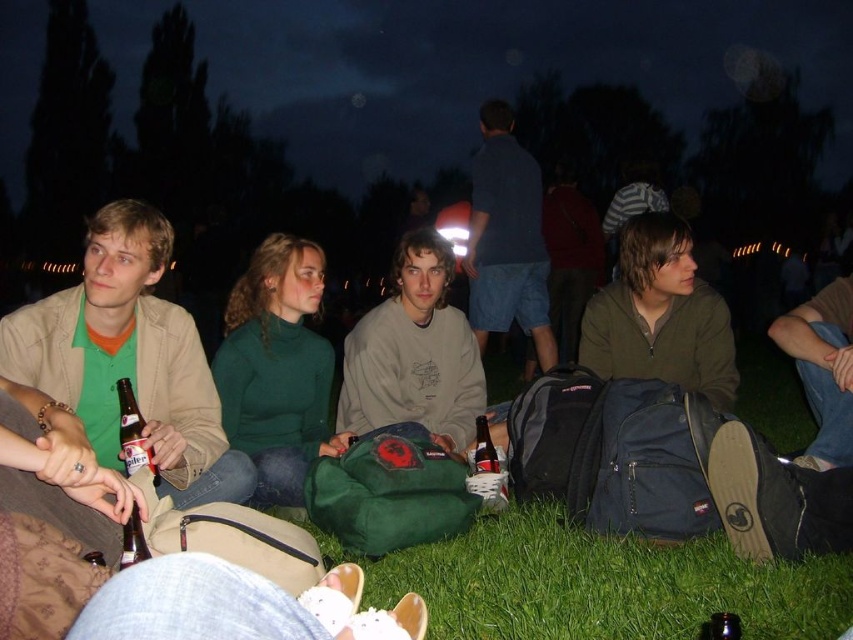
Question: Which object is farther from the camera taking this photo?

Choices:
 (A) translucent glass bottle at lower left
 (B) green zip-up jacket at center
 (C) translucent plastic bottle at lower left

Answer: (B)

Question: Estimate the real-world distances between objects in this image. Which object is farther from the translucent glass bottle at lower left?

Choices:
 (A) matte green shirt at left
 (B) dark blue cotton shirt at center
 (C) translucent plastic bottle at lower left
 (D) light gray sweatshirt at center

Answer: (B)

Question: Is green matte sweater at center to the left of translucent glass bottle at lower left from the viewer's perspective?

Choices:
 (A) yes
 (B) no

Answer: (B)

Question: Which is nearer to the translucent glass bottle at lower left?

Choices:
 (A) translucent plastic bottle at lower left
 (B) green grass at lower center
 (C) green zip-up jacket at center

Answer: (A)

Question: Where is light gray sweatshirt at center located in relation to brown glass bottle at center in the image?

Choices:
 (A) left
 (B) right

Answer: (A)

Question: Considering the relative positions of light gray sweatshirt at center and dark blue cotton shirt at center in the image provided, where is light gray sweatshirt at center located with respect to dark blue cotton shirt at center?

Choices:
 (A) above
 (B) below

Answer: (B)